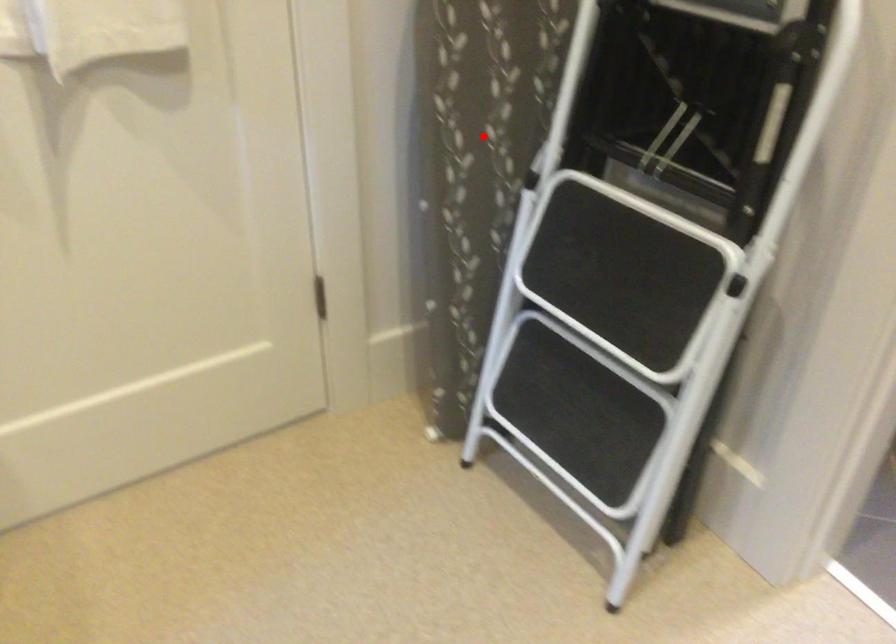
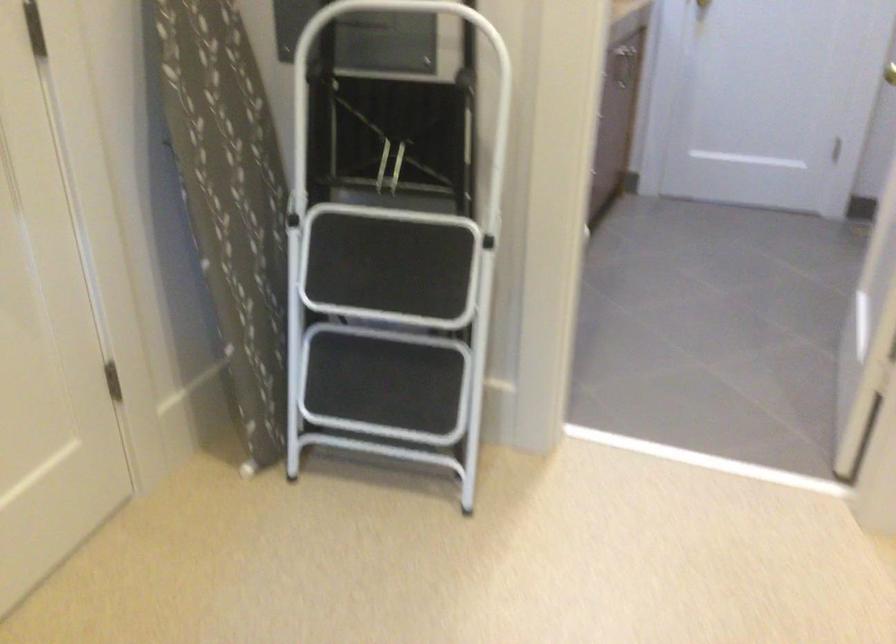
Question: I am providing you with two images of the same scene from different viewpoints. A red point is shown in image1. For the corresponding object point in image2, is it positioned nearer or farther from the camera?

Choices:
 (A) Nearer
 (B) Farther

Answer: (B)